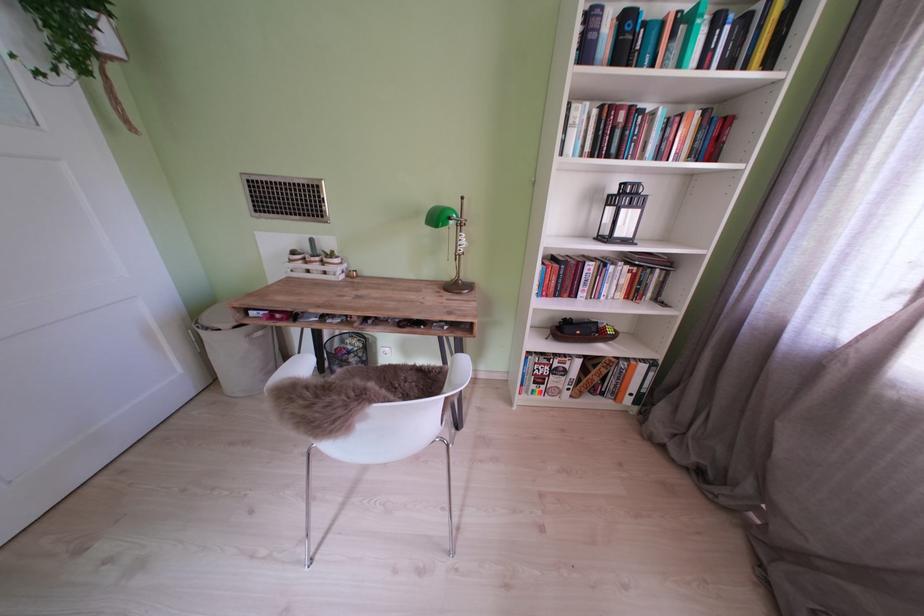
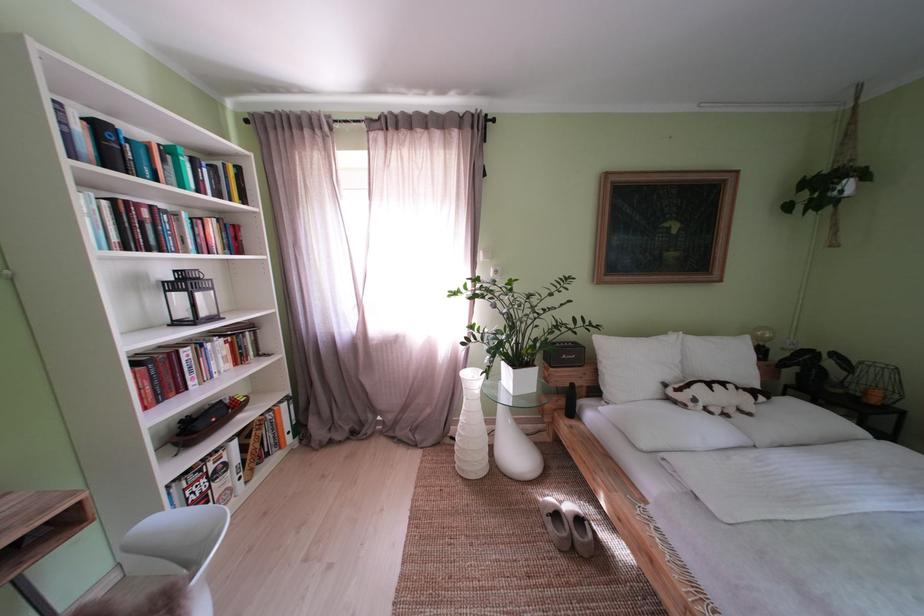
The point at (664, 119) is marked in the first image. Where is the corresponding point in the second image?

(188, 220)